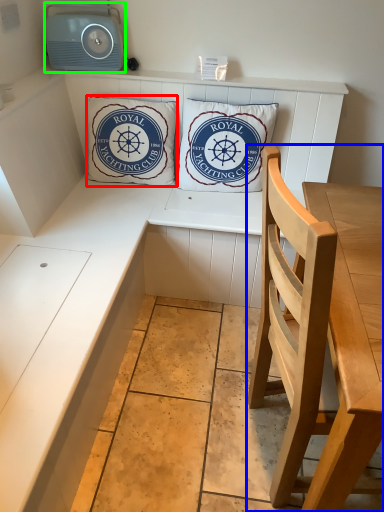
Question: Which object is positioned farthest from pillow (highlighted by a red box)? Select from chair (highlighted by a blue box) and stereo (highlighted by a green box).

Choices:
 (A) chair
 (B) stereo

Answer: (A)